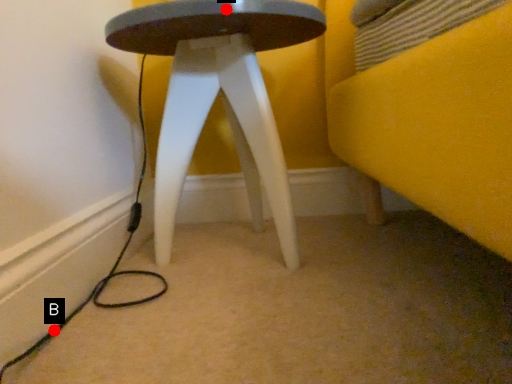
Question: Two points are circled on the image, labeled by A and B beside each circle. Which point is closer to the camera?

Choices:
 (A) A is closer
 (B) B is closer

Answer: (B)